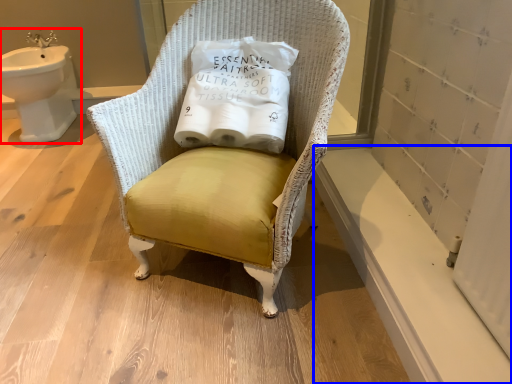
Question: Which point is further to the camera, sink (highlighted by a red box) or window sill (highlighted by a blue box)?

Choices:
 (A) sink
 (B) window sill

Answer: (A)